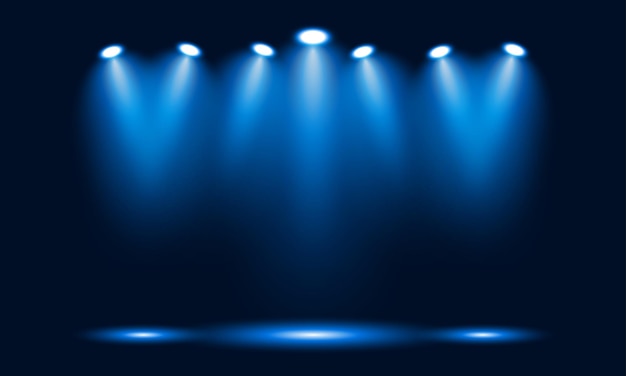
I want to click on spotlights, so click(116, 51), click(200, 48), click(267, 46), click(310, 34), click(359, 47), click(441, 51), click(516, 50).